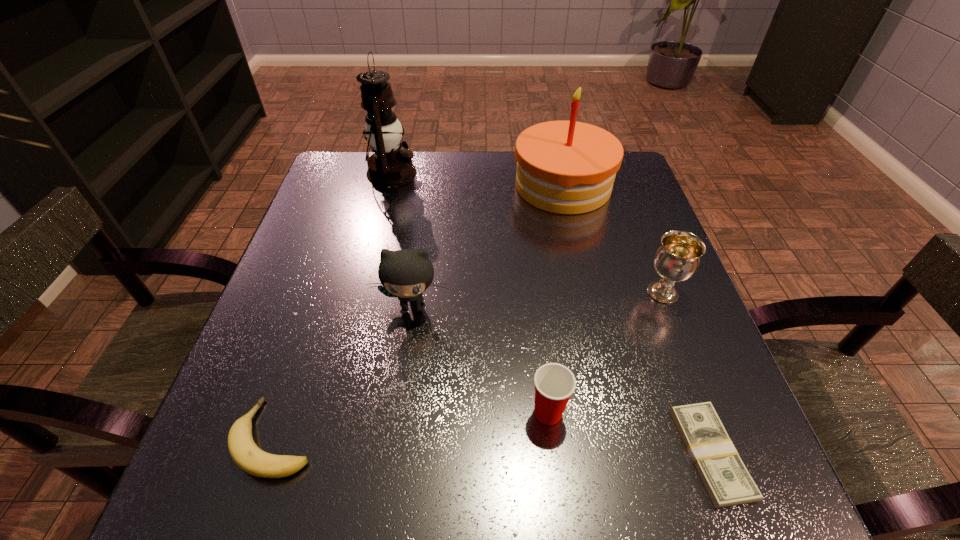
You are a GUI agent. You are given a task and a screenshot of the screen. Output one action in this format:
    pyautogui.click(x=<x>, y=<y>)
    Task: Click on the vacant space located on the left of the chalice
    Image resolution: width=960 pixels, height=540 pixels.
    Given the screenshot: What is the action you would take?
    pyautogui.click(x=540, y=293)

The image size is (960, 540). What are the coordinates of `free space located 0.350m on the back of the Dixie cup` in the screenshot? It's located at (530, 252).

What are the coordinates of `vacant area situated 0.300m on the right of the sixth tallest object` in the screenshot? It's located at (512, 437).

The width and height of the screenshot is (960, 540). I want to click on vacant region located on the left of the shortest object, so click(x=609, y=454).

Where is `lantern that is at the far edge`? lantern that is at the far edge is located at coordinates click(389, 166).

You are a GUI agent. You are given a task and a screenshot of the screen. Output one action in this format:
    pyautogui.click(x=<x>, y=<y>)
    Task: Click on the birthday cake located in the far edge section of the desktop
    This screenshot has height=540, width=960.
    Given the screenshot: What is the action you would take?
    pyautogui.click(x=566, y=167)

I want to click on banana that is at the near edge, so click(245, 453).

The width and height of the screenshot is (960, 540). In order to click on dollar at the near edge in this screenshot , I will do coord(725,477).

Locate an element on the screen. lantern situated at the left edge is located at coordinates pos(389,166).

Locate an element on the screen. This screenshot has height=540, width=960. banana positioned at the left edge is located at coordinates (245, 453).